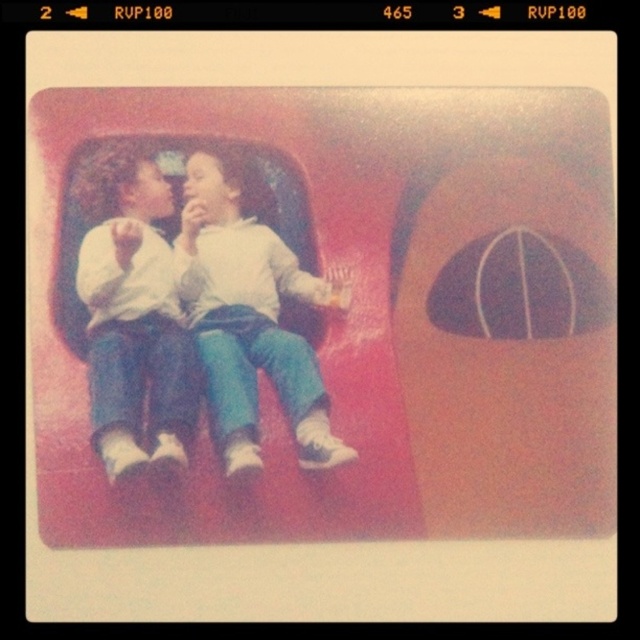
Question: Can you confirm if matte white hoodie at center is positioned above white cotton shirt at center?

Choices:
 (A) no
 (B) yes

Answer: (B)

Question: Is matte white hoodie at center above white cotton shirt at center?

Choices:
 (A) yes
 (B) no

Answer: (A)

Question: Is matte white hoodie at center thinner than white cotton shirt at center?

Choices:
 (A) no
 (B) yes

Answer: (A)